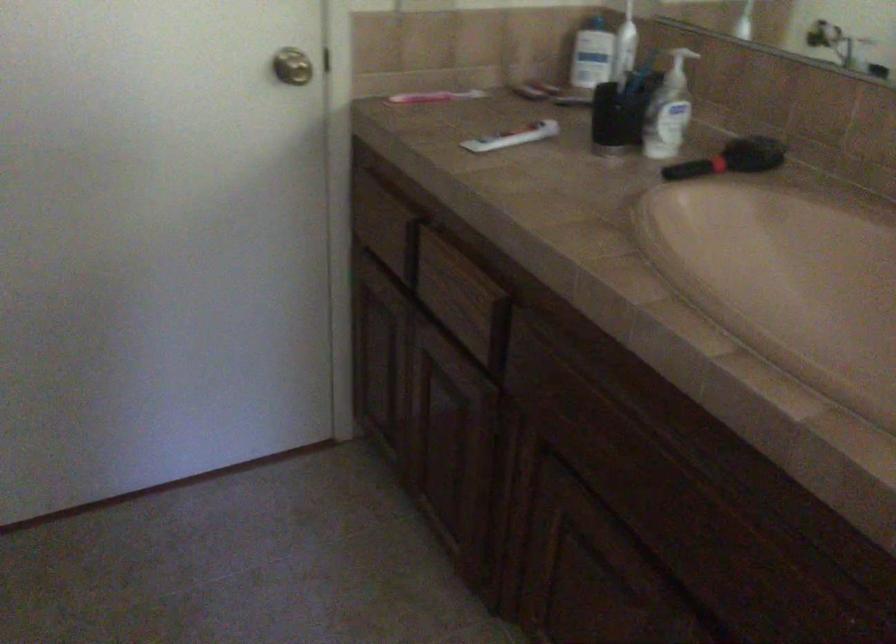
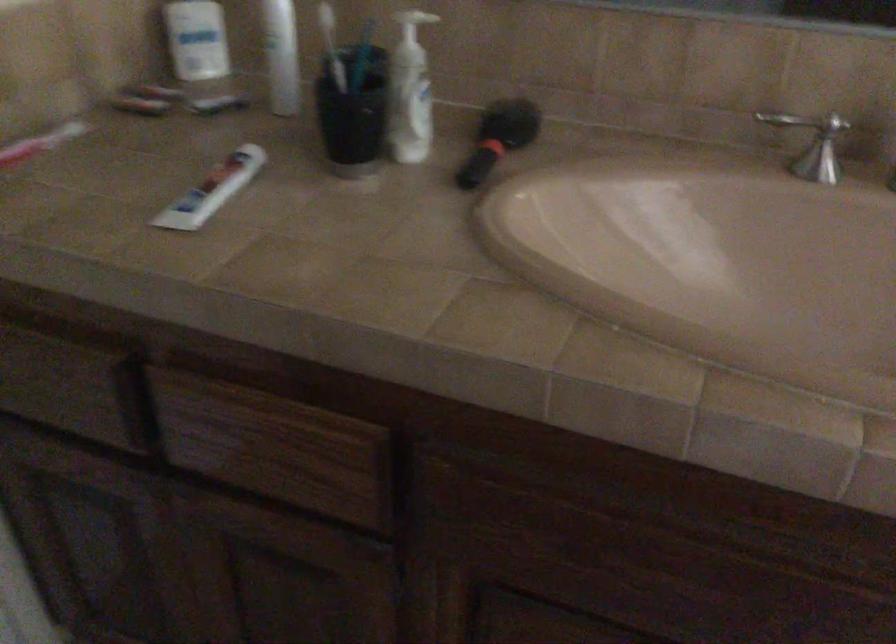
In the second image, find the point that corresponds to point 389,228 in the first image.

(74, 388)